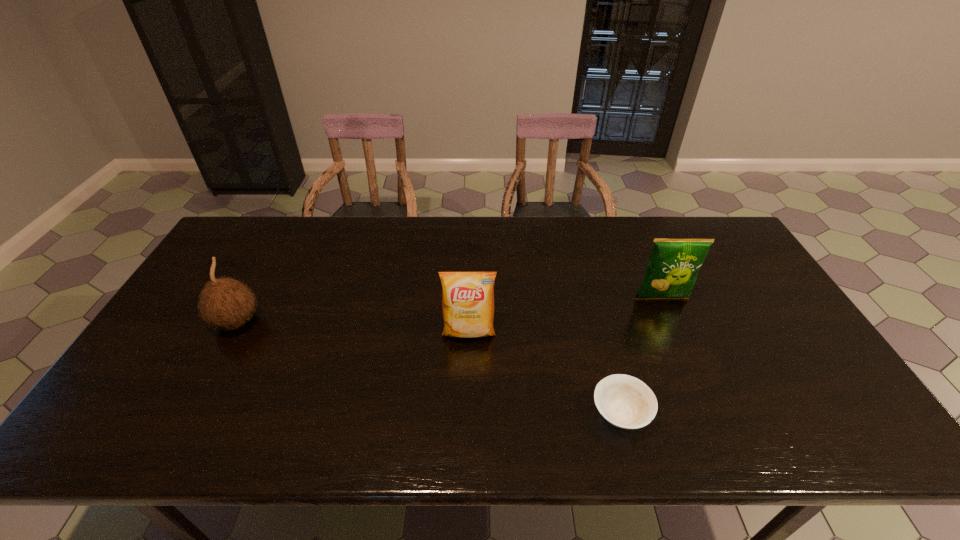
The height and width of the screenshot is (540, 960). I want to click on the farther crisp (potato chip), so click(x=673, y=266).

You are a GUI agent. You are given a task and a screenshot of the screen. Output one action in this format:
    pyautogui.click(x=<x>, y=<y>)
    Task: Click on the right crisp (potato chip)
    The height and width of the screenshot is (540, 960).
    Given the screenshot: What is the action you would take?
    [673, 266]

This screenshot has height=540, width=960. What are the coordinates of `the leftmost object` in the screenshot? It's located at (224, 303).

At what (x,y) coordinates should I click in order to perform the action: click on the nearer crisp (potato chip). Please return your answer as a coordinate pair (x, y). Looking at the image, I should click on (467, 297).

At what (x,y) coordinates should I click in order to perform the action: click on the third object from right to left. Please return your answer as a coordinate pair (x, y). Looking at the image, I should click on (467, 297).

Where is `the nearest object`? This screenshot has width=960, height=540. the nearest object is located at coordinates (624, 401).

Where is `bowl`? The image size is (960, 540). bowl is located at coordinates (624, 401).

The height and width of the screenshot is (540, 960). What are the coordinates of `free space located 0.220m on the front-facing side of the farther crisp (potato chip)` in the screenshot? It's located at (691, 368).

At what (x,y) coordinates should I click in order to perform the action: click on free space located 0.240m on the surface of the coconut. Please return your answer as a coordinate pair (x, y). The image size is (960, 540). Looking at the image, I should click on (348, 322).

You are a GUI agent. You are given a task and a screenshot of the screen. Output one action in this format:
    pyautogui.click(x=<x>, y=<y>)
    Task: Click on the free space located 0.260m on the front-facing side of the second object from left to right
    
    Given the screenshot: What is the action you would take?
    pyautogui.click(x=467, y=435)